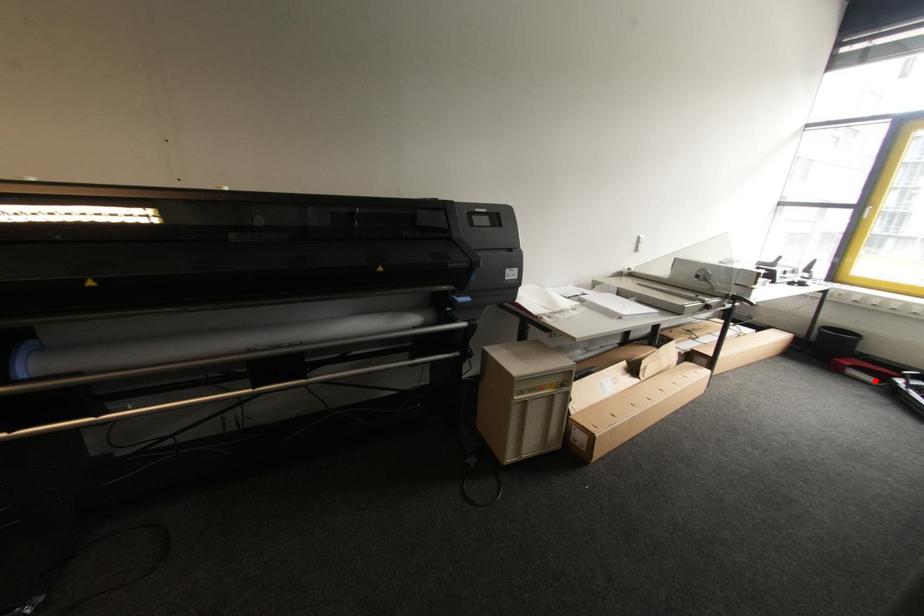
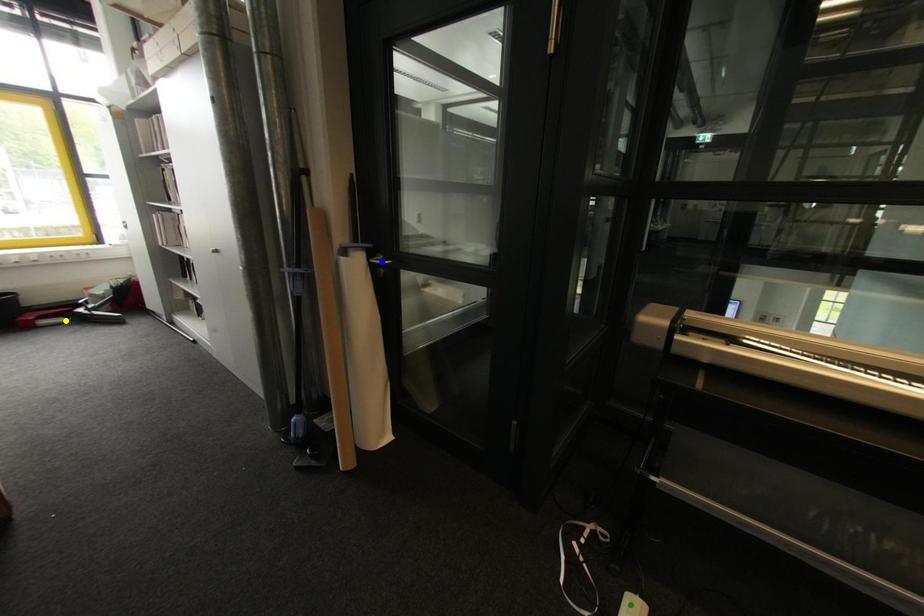
Question: I am providing you with two images of the same scene from different viewpoints. A red point is marked on the first image. You are given multiple points on the second image. Which point in image 2 is actually the same real-world point as the red point in image 1?

Choices:
 (A) yellow point
 (B) blue point
 (C) green point

Answer: (A)